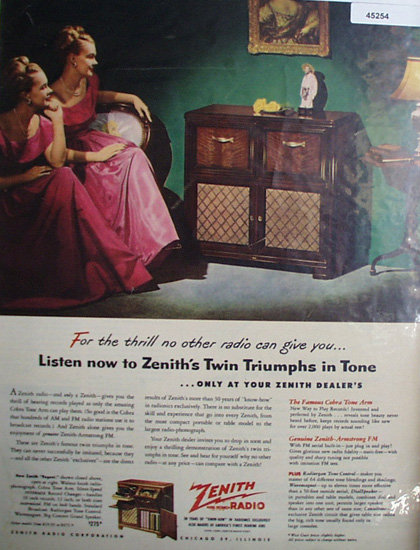
This screenshot has height=550, width=420. In order to click on painting in this screenshot , I will do `click(298, 27)`.